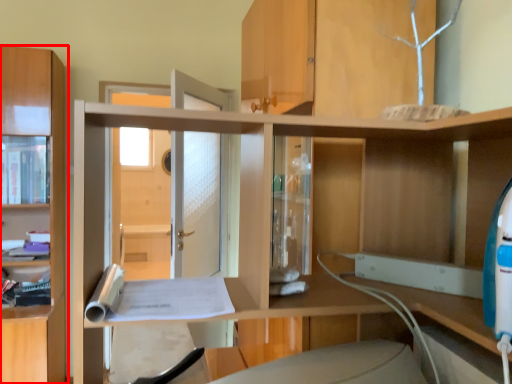
Question: Where is cabinetry (annotated by the red box) located in relation to cabinet in the image?

Choices:
 (A) left
 (B) right

Answer: (B)